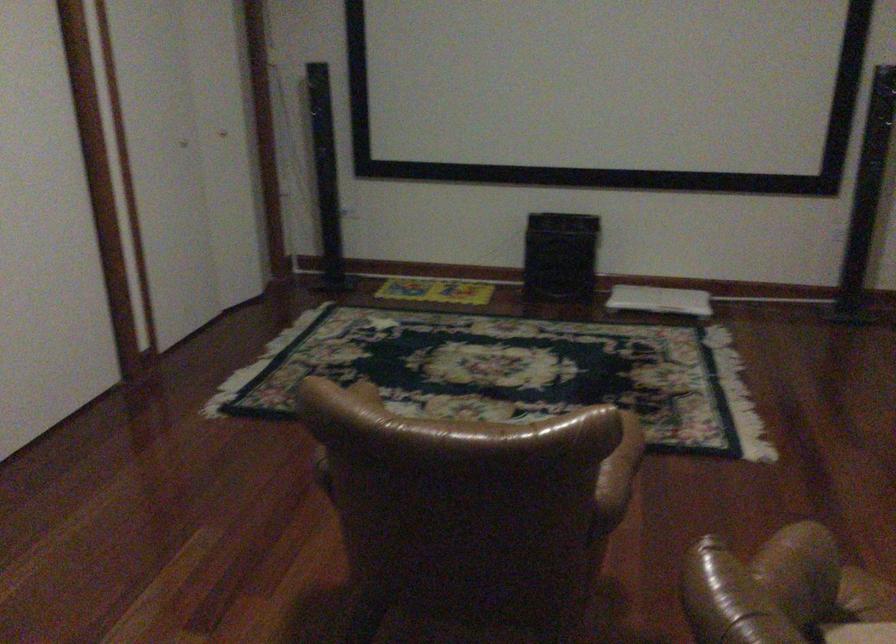
Describe the element at coordinates (560, 257) in the screenshot. The width and height of the screenshot is (896, 644). I see `the black speaker box` at that location.